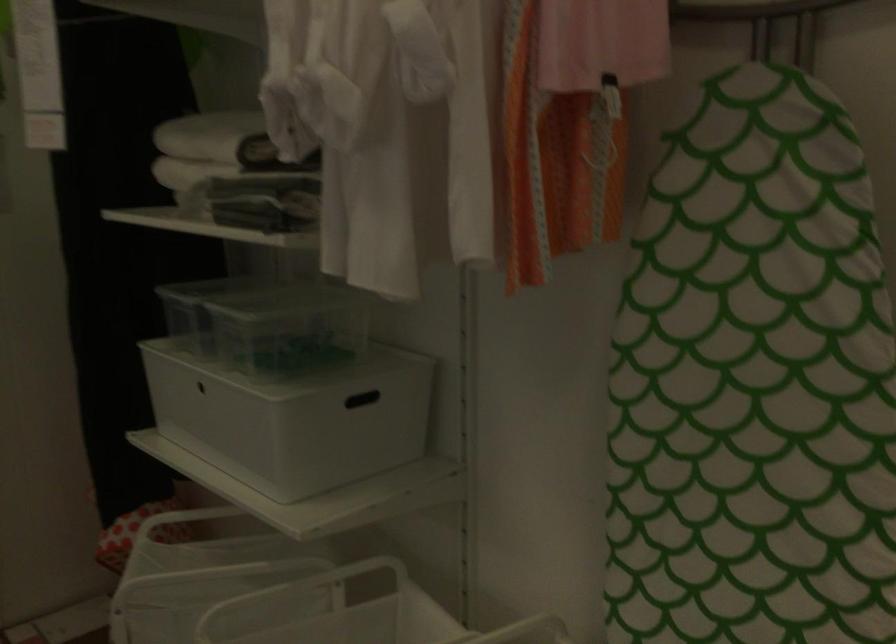
Identify the location of white box handle. (362, 400).